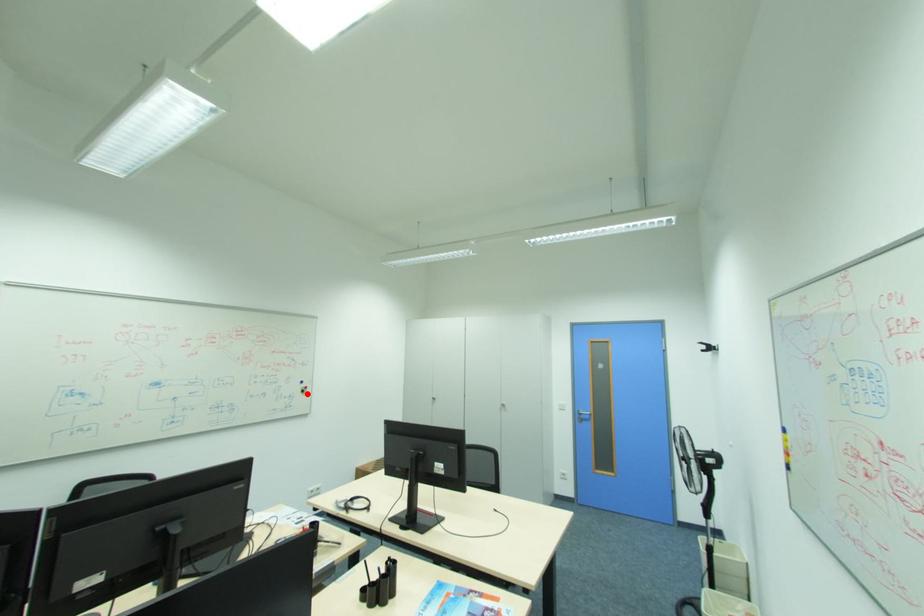
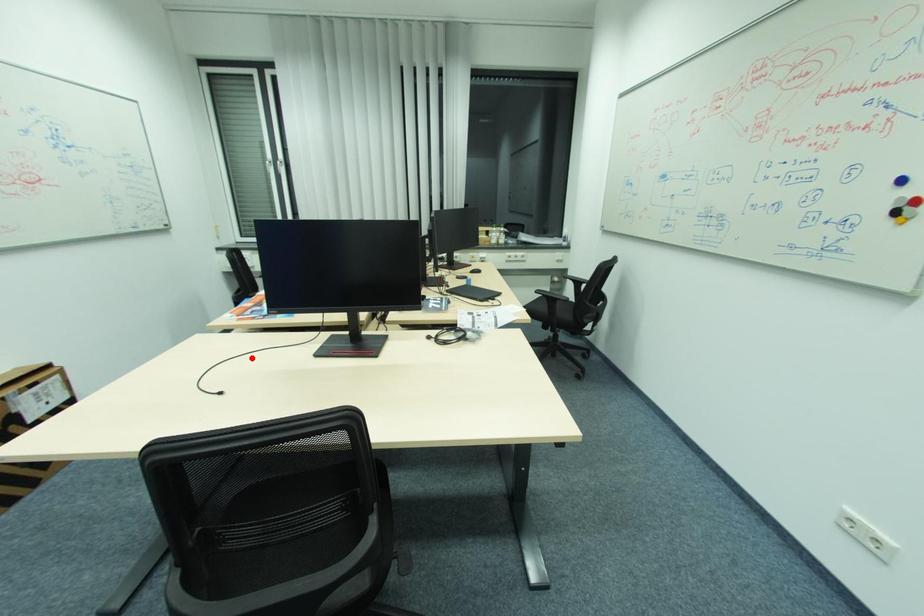
I am providing you with two images of the same scene from different viewpoints. A red point is marked on the first image and another point is marked on the second image. Are the points marked in image1 and image2 representing the same 3D position?

No